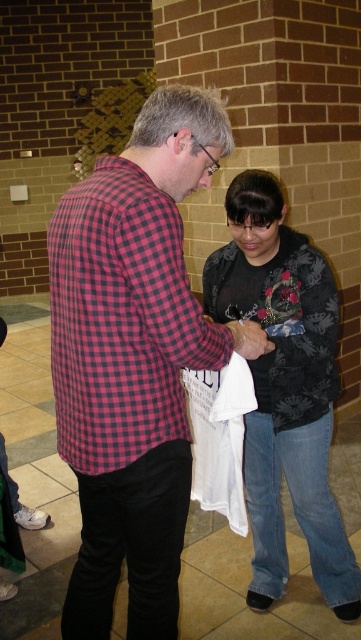
Question: Observing the image, what is the correct spatial positioning of plaid shirt at center in reference to plaid fabric shirt at left?

Choices:
 (A) above
 (B) below

Answer: (B)

Question: Which point appears closest to the camera in this image?

Choices:
 (A) (163, 486)
 (B) (116, 168)
 (C) (259, 552)

Answer: (B)

Question: Where is plaid shirt at center located in relation to plaid fabric shirt at left in the image?

Choices:
 (A) left
 (B) right

Answer: (B)

Question: Is plaid shirt at center wider than dark floral sweater at center?

Choices:
 (A) no
 (B) yes

Answer: (B)

Question: Which point is closer to the camera taking this photo?

Choices:
 (A) (275, 324)
 (B) (154, 339)
 (C) (50, 285)

Answer: (B)

Question: Which object is farther from the camera taking this photo?

Choices:
 (A) dark floral sweater at center
 (B) plaid shirt at center
 (C) plaid fabric shirt at left

Answer: (A)